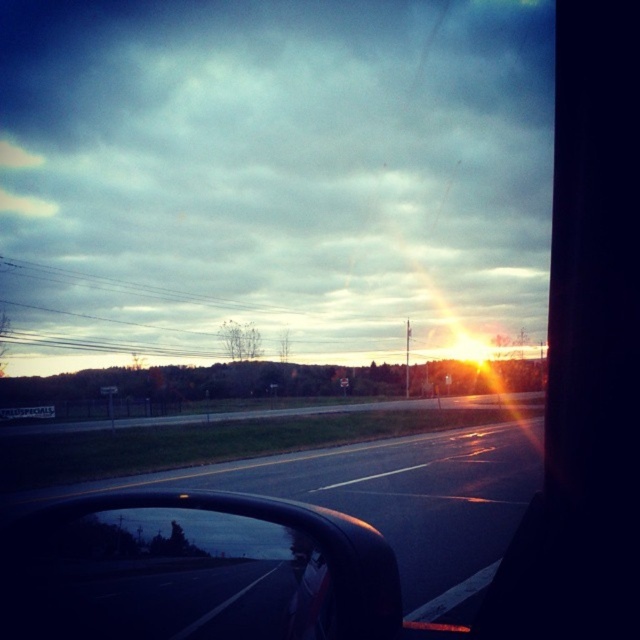
Between black asphalt highway at center and black glossy rearview mirror at lower left, which one has less height?

black glossy rearview mirror at lower left is shorter.

Measure the distance between black asphalt highway at center and camera.

black asphalt highway at center and camera are 5.83 feet apart from each other.

Find the location of `black asphalt highway at center`. black asphalt highway at center is located at coordinates pyautogui.click(x=269, y=541).